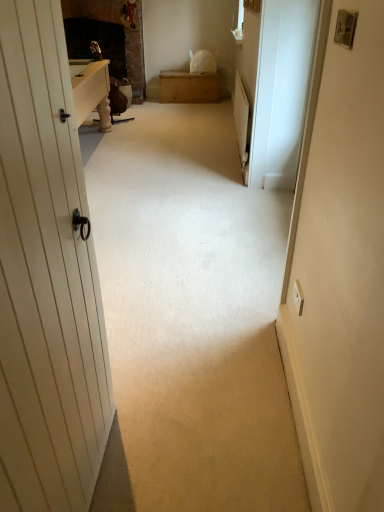
Question: From the image's perspective, is metallic silver lock at upper right on wooden chest at center?

Choices:
 (A) no
 (B) yes

Answer: (A)

Question: Is metallic silver lock at upper right closer to camera compared to wooden chest at center?

Choices:
 (A) yes
 (B) no

Answer: (A)

Question: Is metallic silver lock at upper right located outside wooden chest at center?

Choices:
 (A) yes
 (B) no

Answer: (A)

Question: Are metallic silver lock at upper right and wooden chest at center located far from each other?

Choices:
 (A) no
 (B) yes

Answer: (B)

Question: Does metallic silver lock at upper right appear on the right side of wooden chest at center?

Choices:
 (A) no
 (B) yes

Answer: (B)

Question: Considering the positions of wooden chest at center and metallic silver lock at upper right in the image, is wooden chest at center taller or shorter than metallic silver lock at upper right?

Choices:
 (A) short
 (B) tall

Answer: (B)

Question: In terms of width, does wooden chest at center look wider or thinner when compared to metallic silver lock at upper right?

Choices:
 (A) wide
 (B) thin

Answer: (A)

Question: Is wooden chest at center situated inside metallic silver lock at upper right or outside?

Choices:
 (A) inside
 (B) outside

Answer: (B)

Question: Considering their positions, is wooden chest at center located in front of or behind metallic silver lock at upper right?

Choices:
 (A) behind
 (B) front

Answer: (A)

Question: Visually, is white glossy screen door at right positioned to the left or to the right of wooden chest at center?

Choices:
 (A) right
 (B) left

Answer: (A)

Question: Considering the positions of point (254, 166) and point (162, 92), is point (254, 166) closer or farther from the camera than point (162, 92)?

Choices:
 (A) closer
 (B) farther

Answer: (A)

Question: From a real-world perspective, relative to wooden chest at center, is white glossy screen door at right vertically above or below?

Choices:
 (A) above
 (B) below

Answer: (A)

Question: From the image's perspective, is white glossy screen door at right above or below wooden chest at center?

Choices:
 (A) above
 (B) below

Answer: (B)

Question: Does point (349, 16) appear closer or farther from the camera than point (198, 94)?

Choices:
 (A) farther
 (B) closer

Answer: (B)

Question: Is metallic silver lock at upper right taller or shorter than wooden chest at center?

Choices:
 (A) tall
 (B) short

Answer: (B)